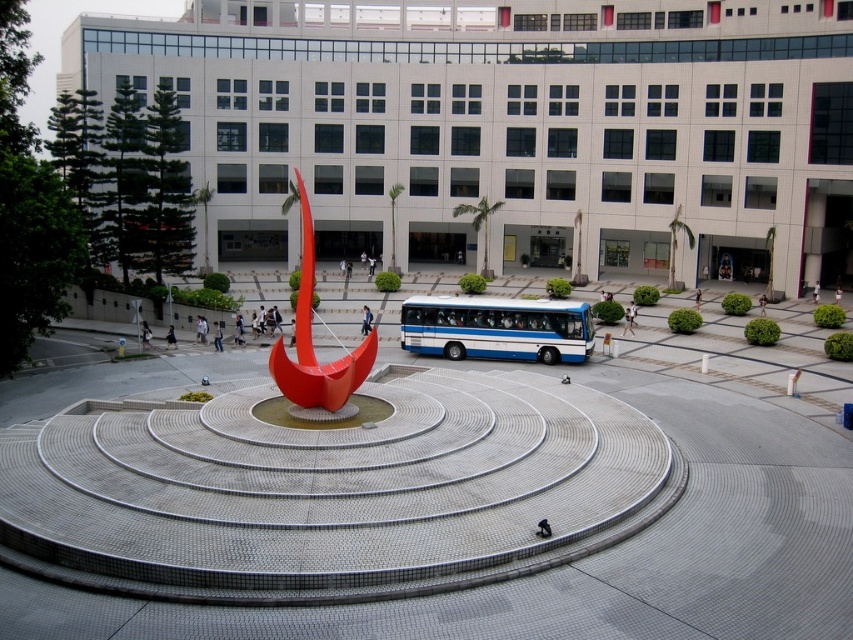
Question: Does blue/white bus at center have a larger size compared to glossy red sculpture at center?

Choices:
 (A) no
 (B) yes

Answer: (A)

Question: Is blue/white bus at center positioned behind glossy red sculpture at center?

Choices:
 (A) no
 (B) yes

Answer: (B)

Question: Which of the following is the farthest from the observer?

Choices:
 (A) (544, 326)
 (B) (302, 387)

Answer: (A)

Question: Among these objects, which one is farthest from the camera?

Choices:
 (A) glossy red sculpture at center
 (B) blue/white bus at center

Answer: (B)

Question: Which object appears closest to the camera in this image?

Choices:
 (A) glossy red sculpture at center
 (B) blue/white bus at center

Answer: (A)

Question: Is blue/white bus at center bigger than glossy red sculpture at center?

Choices:
 (A) yes
 (B) no

Answer: (B)